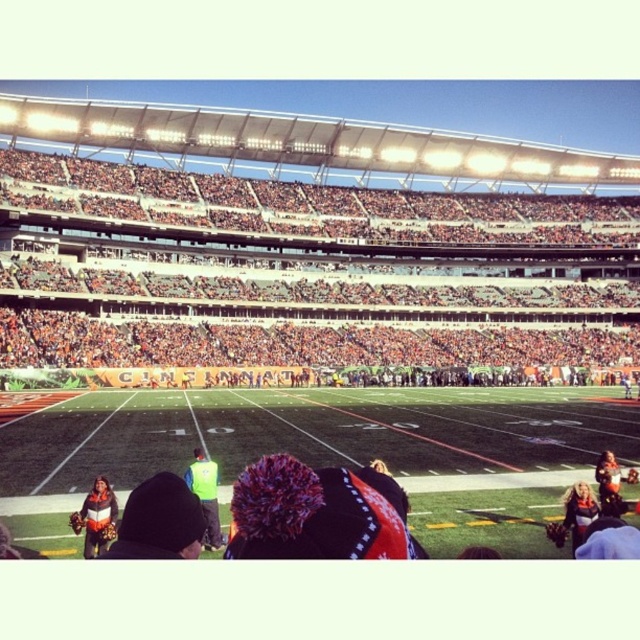
You are standing at the point marked as point (195,308) in the stadium. The distance from you to the nearest exit is 100.97 meters. Can you estimate how far you are from the exit?

You are exactly 100.97 meters away from the exit, as the distance of point (195,308) from the viewer is 100.97 meters.

In the scene shown: You are a safety inspector at the stadium and need to ensure that the distance between the neon yellow vest at center and the orange jersey at lower right meets the minimum safety requirement of 15 meters. Based on the scene, does the current distance comply with the safety standard?

The neon yellow vest at center and orange jersey at lower right are 17.95 meters apart from each other, which exceeds the minimum safety requirement of 15 meters. Therefore, the current distance complies with the safety standard.